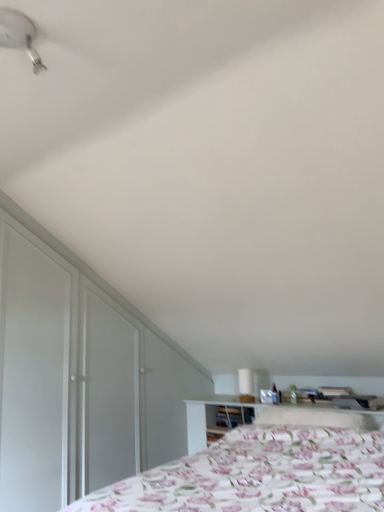
I want to click on vacant area on top of white plastic fan at upper left (from a real-world perspective), so click(21, 32).